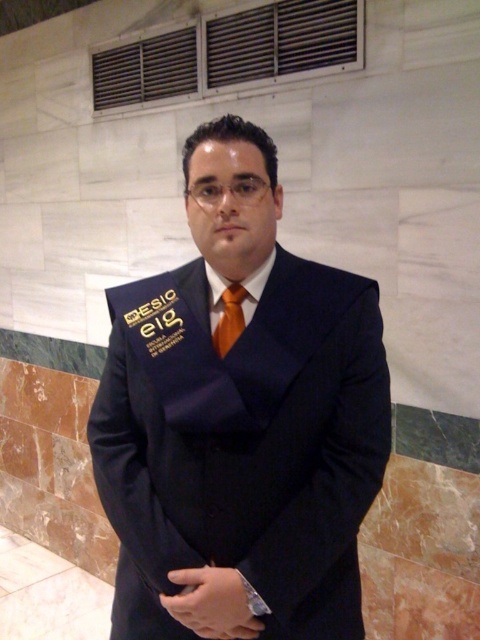
Does navy blue suit at center appear on the right side of orange satin tie at center?

Incorrect, navy blue suit at center is not on the right side of orange satin tie at center.

Based on the photo, can you confirm if navy blue suit at center is wider than orange satin tie at center?

Yes, navy blue suit at center is wider than orange satin tie at center.

At what (x,y) coordinates should I click in order to perform the action: click on navy blue suit at center. Please return your answer as a coordinate pair (x, y). Image resolution: width=480 pixels, height=640 pixels. Looking at the image, I should click on (240, 420).